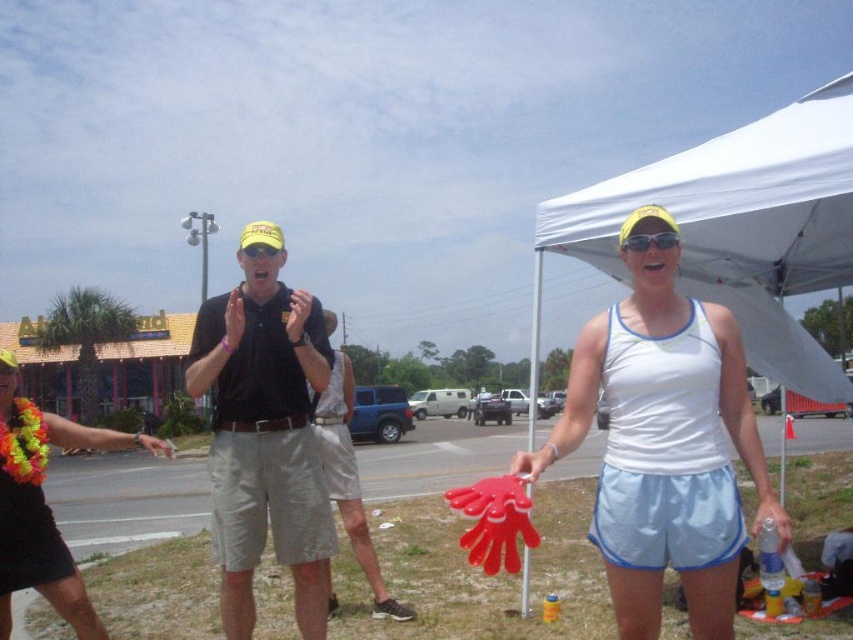
Question: Estimate the real-world distances between objects in this image. Which object is farther from the floral lei at center?

Choices:
 (A) sunglassestransparent at upper center
 (B) black matte shirt at center
 (C) white fabric canopy at upper right

Answer: (C)

Question: Which object appears farthest from the camera in this image?

Choices:
 (A) white fabric tank top at center
 (B) white fabric canopy at upper right
 (C) sunglassestransparent at upper center
 (D) matte yellow goggles at center

Answer: (B)

Question: Can you confirm if white fabric canopy at upper right is wider than floral lei at center?

Choices:
 (A) yes
 (B) no

Answer: (A)

Question: Can you confirm if white fabric tank top at center is thinner than black matte shirt at center?

Choices:
 (A) no
 (B) yes

Answer: (A)

Question: From the image, what is the correct spatial relationship of floral lei at center in relation to matte yellow goggles at center?

Choices:
 (A) below
 (B) above

Answer: (A)

Question: Among these points, which one is nearest to the camera?

Choices:
 (A) (3, 589)
 (B) (809, 188)
 (C) (640, 240)

Answer: (C)